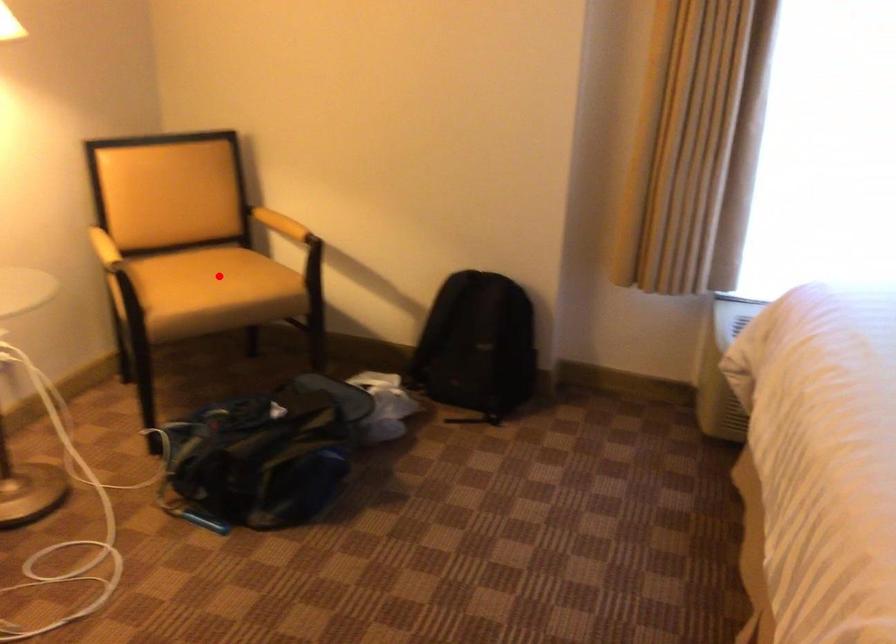
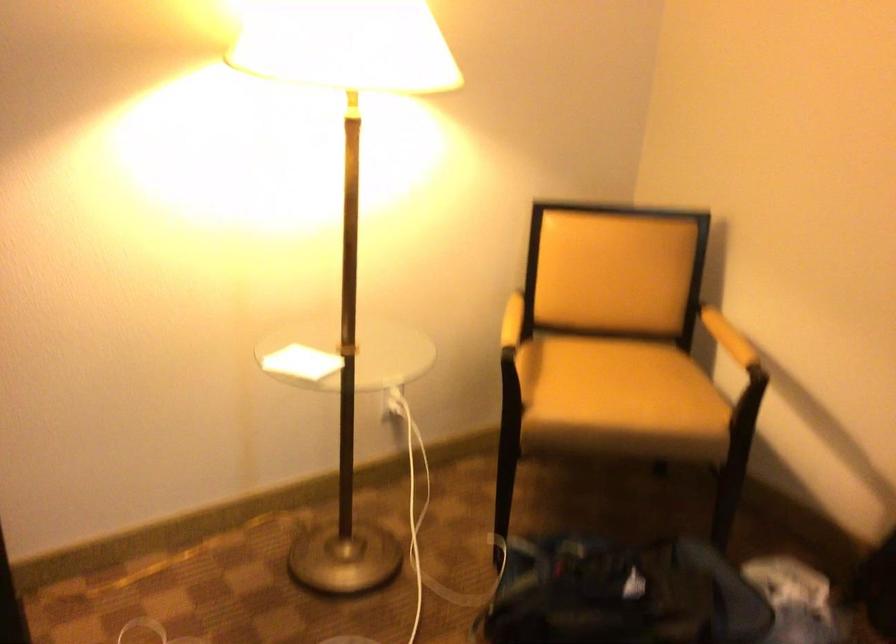
The point at the highlighted location is marked in the first image. Where is the corresponding point in the second image?

(618, 388)